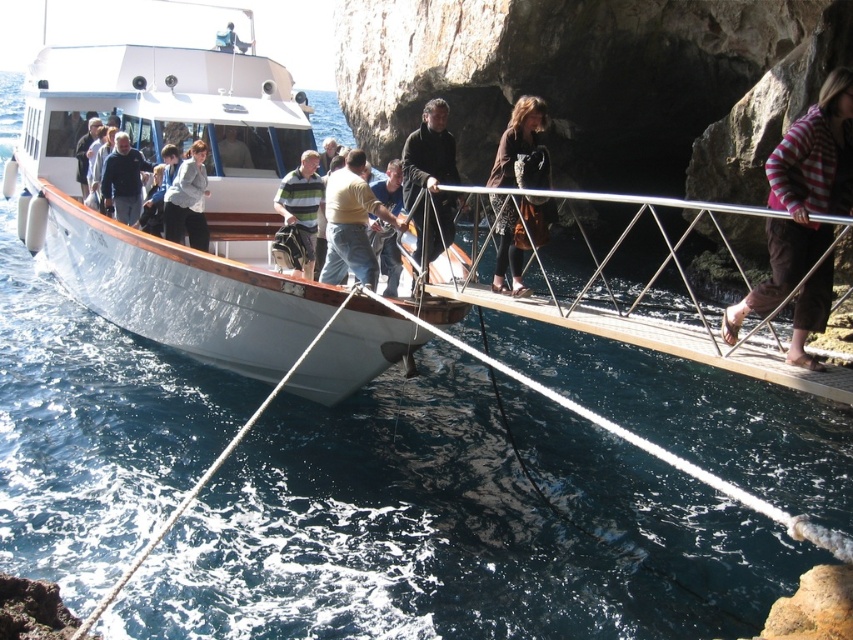
Question: From the image, what is the correct spatial relationship of brown leather jacket at center in relation to striped cotton shirt at center?

Choices:
 (A) left
 (B) right

Answer: (B)

Question: Among these points, which one is farthest from the camera?

Choices:
 (A) (521, 275)
 (B) (737, 307)

Answer: (A)

Question: Which object is closer to the camera taking this photo?

Choices:
 (A) white polished wood boat at center
 (B) light brown denim jeans at center

Answer: (A)

Question: Is brown leather jacket at center positioned in front of striped cotton shirt at center?

Choices:
 (A) no
 (B) yes

Answer: (B)

Question: Does light brown denim jeans at center have a greater width compared to striped cotton shirt at center?

Choices:
 (A) no
 (B) yes

Answer: (B)

Question: Which of the following is the farthest from the observer?

Choices:
 (A) (256, 355)
 (B) (292, 192)
 (C) (814, 323)

Answer: (B)